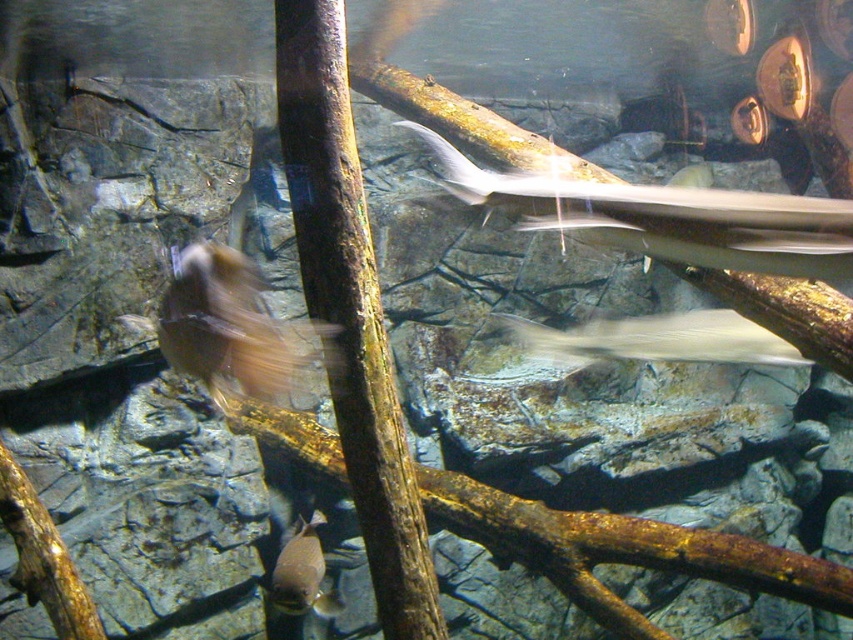
You are an underwater photographer aiming to capture both the silvery smooth shark at upper center and the shiny silver fish at lower center in a single frame. Given their sizes, which one would require you to adjust your camera focus more to ensure clarity?

The silvery smooth shark at upper center requires more focus adjustment because it is wider than the shiny silver fish at lower center, so you need to adjust the camera focus accordingly to capture its full size clearly.

You are an underwater photographer aiming to capture the silvery smooth shark at upper center. Based on its position relative to the rocky background and the wooden branches in the foreground, where should you position your camera to ensure the shark is centered in the frame?

The silvery smooth shark at upper center is located at point coordinates, so positioning the camera directly facing that coordinate will center the shark in the frame.

You are a marine biologist observing an underwater scene in an aquarium. You notice a translucent white shark at center. Can you provide its coordinates in the image?

The translucent white shark at center is located at point (x=654, y=339).